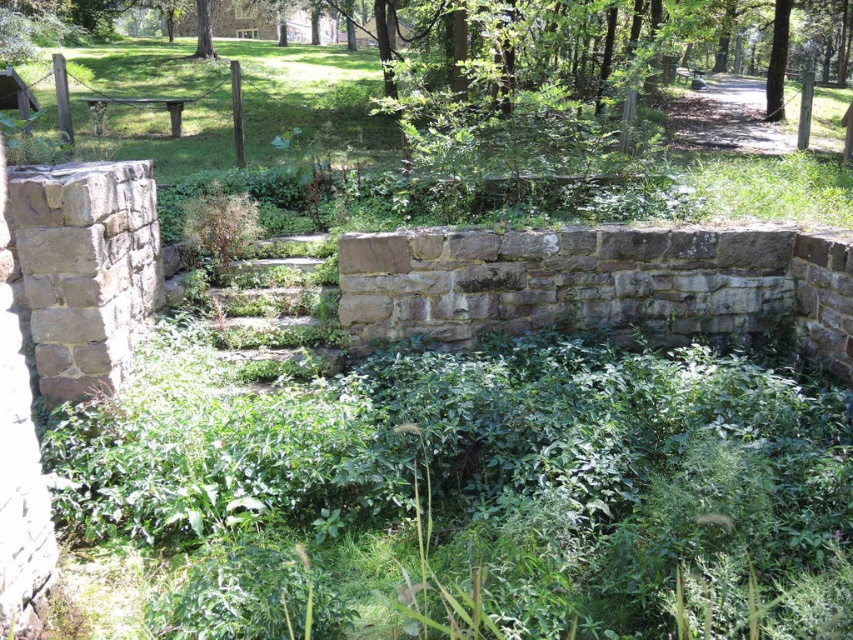
You are an architect designing a new garden layout and need to know the spatial relationship between the green leafy tree at upper right and the green leafy tree at upper center. Which tree has a greater width?

The green leafy tree at upper right has a greater width than the green leafy tree at upper center.

From the picture: You are a landscape architect designing a walking path between the green leafy tree at upper right and the green leafy tree at upper center. What is the minimum length of the path required to connect them directly?

The green leafy tree at upper right and green leafy tree at upper center are 14.27 meters apart, so the minimum length of the path required to connect them directly is 14.27 meters.